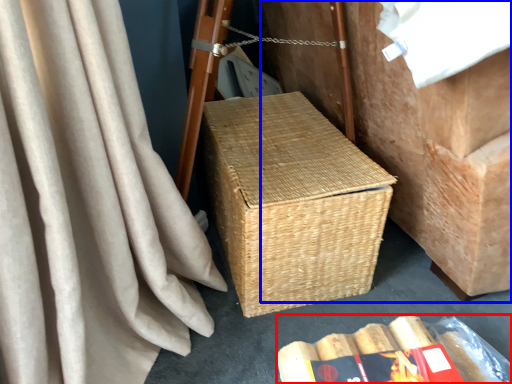
Question: Which point is further to the camera, storage box (highlighted by a red box) or furniture (highlighted by a blue box)?

Choices:
 (A) storage box
 (B) furniture

Answer: (A)